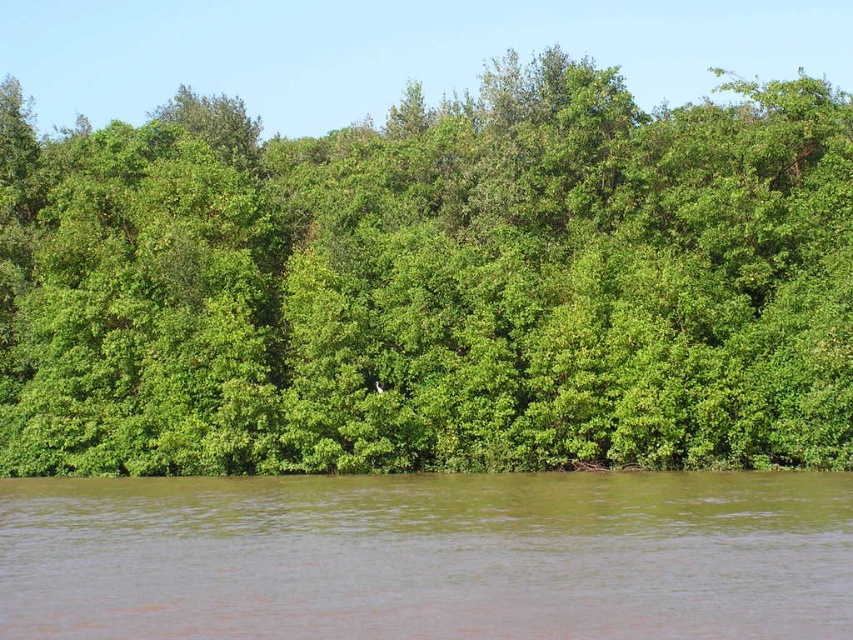
You are a hiker planning to cross from the green leafy trees at center to the brown murky water at lower center. Given that your average stride length is 0.75 meters, approximately how many steps would you need to take to reach the water from the trees?

The distance between the green leafy trees at center and the brown murky water at lower center is 21.89 meters. With an average stride length of 0.75 meters, you would need approximately 29 steps to reach the water from the trees.

You are standing at the riverside and want to walk from point A to point B. Point A is at coordinates point (209, 154) and point B is at coordinates point (802, 477). Which point is closer to you when you start walking?

Point A at coordinates point (209, 154) is closer to you than point B at coordinates point (802, 477) because it is further to the viewer.

You are standing at the riverside and want to take a photo of the green leafy trees at center. If your camera has a maximum zoom range of 100 feet, will you be able to capture the trees clearly without moving closer?

The green leafy trees at center is 150.87 feet away from viewer. Since the camera can only zoom up to 100 feet, you won not be able to capture the trees clearly without moving closer.